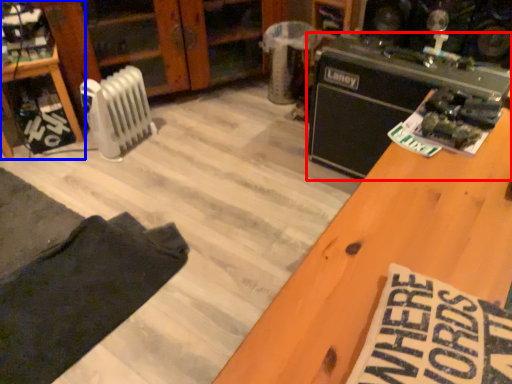
Question: Which of the following is the farthest to the observer, appliance (highlighted by a red box) or furniture (highlighted by a blue box)?

Choices:
 (A) appliance
 (B) furniture

Answer: (B)